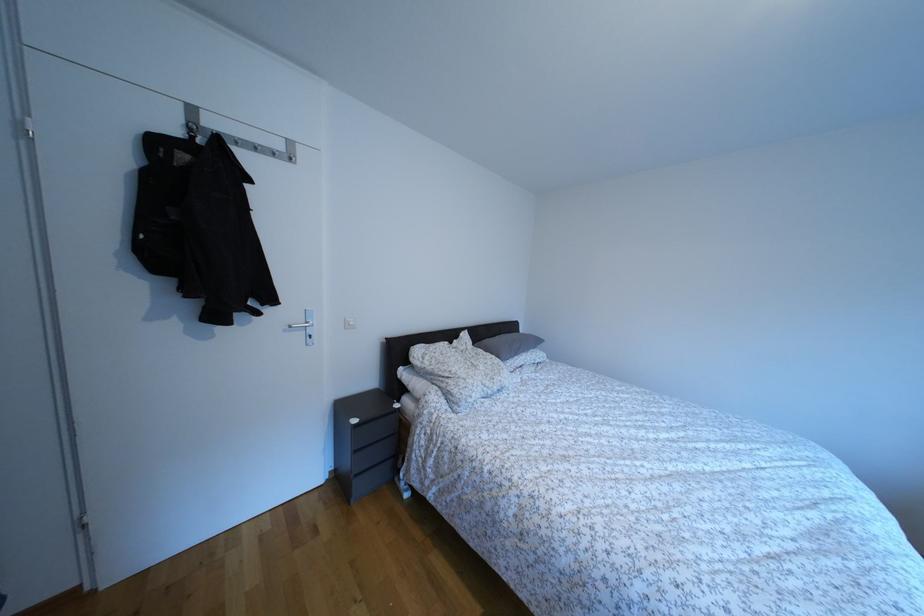
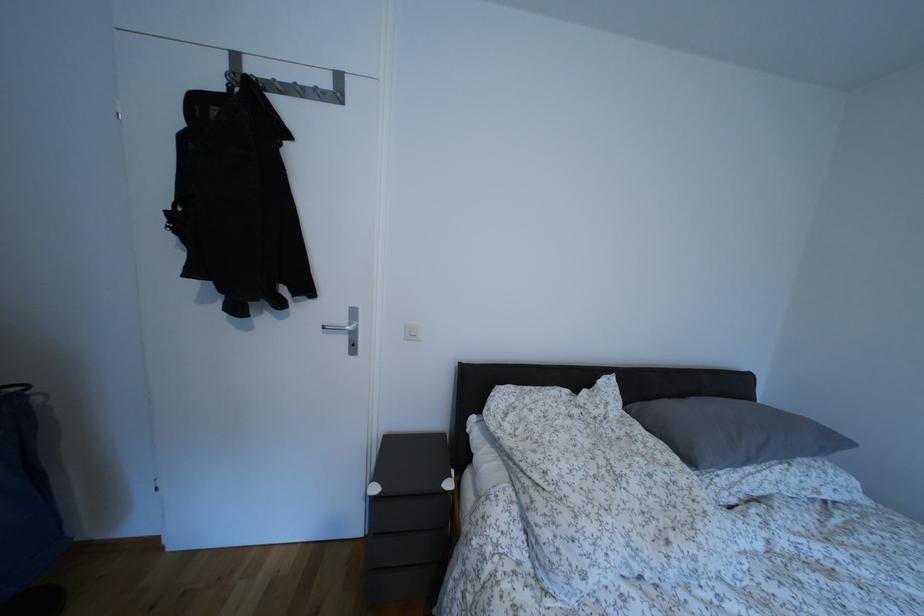
Question: Based on the continuous images, in which direction is the camera rotating? Reply with the corresponding letter.

Choices:
 (A) Left
 (B) Right
 (C) Up
 (D) Down

Answer: (A)